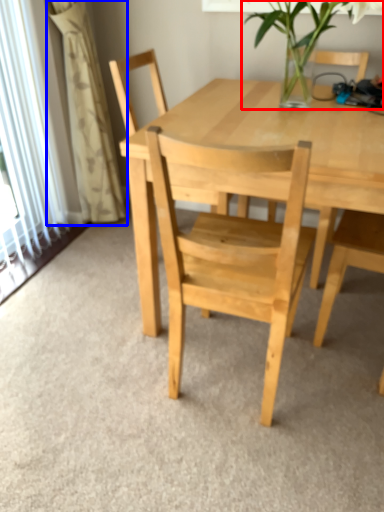
Question: Which object is closer to the camera taking this photo, houseplant (highlighted by a red box) or curtain (highlighted by a blue box)?

Choices:
 (A) houseplant
 (B) curtain

Answer: (A)